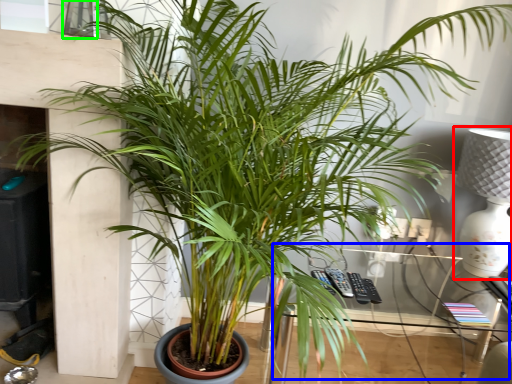
Question: Estimate the real-world distances between objects in this image. Which object is closer to table lamp (highlighted by a red box), table (highlighted by a blue box) or window (highlighted by a green box)?

Choices:
 (A) table
 (B) window

Answer: (A)